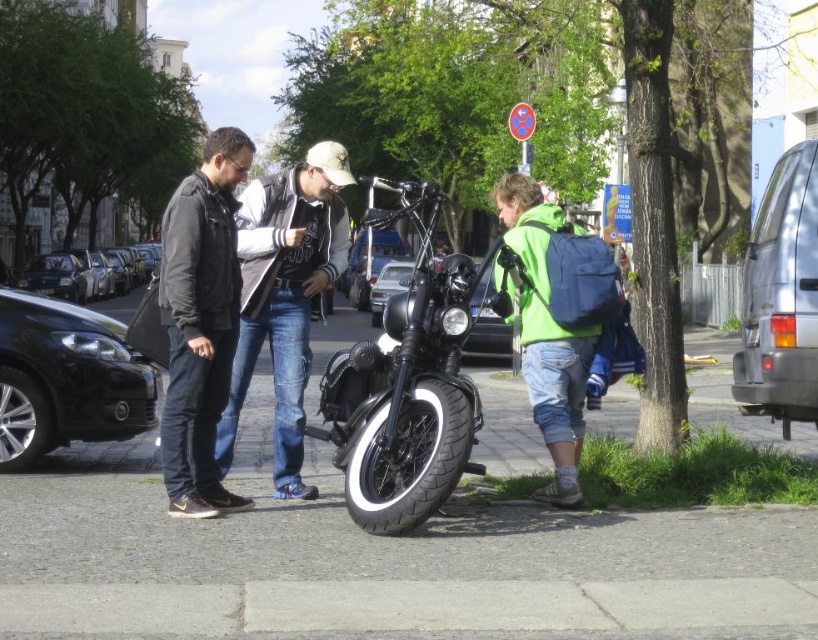
From the picture: You are a photographer trying to capture a photo of the denim jeans at center and the shiny black sedan at left. Based on their heights, which object should you focus on first if you want to frame both in the same shot without moving the camera?

The denim jeans at center is taller than the shiny black sedan at left, so you should focus on the denim jeans at center first to ensure both are properly framed in the shot.